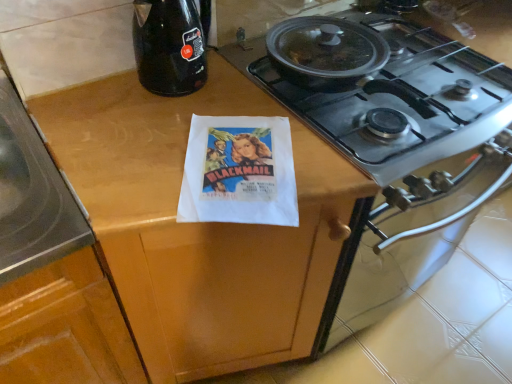
What do you see at coordinates (169, 46) in the screenshot?
I see `black glass bottle at upper left` at bounding box center [169, 46].

You are a GUI agent. You are given a task and a screenshot of the screen. Output one action in this format:
    pyautogui.click(x=<x>, y=<y>)
    Task: Click on the white paper flyer at center
    
    Given the screenshot: What is the action you would take?
    pyautogui.click(x=239, y=172)

Is black glass bottle at upper left bigger than wooden at center?

No, black glass bottle at upper left is not bigger than wooden at center.

From the image's perspective, is black glass bottle at upper left under wooden at center?

No.

In terms of height, does black glass bottle at upper left look taller or shorter compared to wooden at center?

Considering their sizes, black glass bottle at upper left has less height than wooden at center.

Based on the photo, is black glass bottle at upper left directly adjacent to wooden at center?

black glass bottle at upper left and wooden at center are clearly separated.

Which is farther from the camera, (x=240, y=353) or (x=160, y=89)?

The point (x=240, y=353) is farther from the camera.

Which object is positioned more to the right, wooden at center or black glass bottle at upper left?

wooden at center is more to the right.

In the scene shown: From the image's perspective, is wooden at center above black glass bottle at upper left?

No, from the image's perspective, wooden at center is not on top of black glass bottle at upper left.

Is stainless steel gas stove at upper right located outside black glass bottle at upper left?

Yes, stainless steel gas stove at upper right is located beyond the bounds of black glass bottle at upper left.

Can you tell me how much stainless steel gas stove at upper right and black glass bottle at upper left differ in facing direction?

2.15 degrees separate the facing orientations of stainless steel gas stove at upper right and black glass bottle at upper left.

Consider the image. Which object is closer to the camera, stainless steel gas stove at upper right or black glass bottle at upper left?

Positioned in front is stainless steel gas stove at upper right.

Is wooden at center not inside stainless steel gas stove at upper right?

Indeed, wooden at center is completely outside stainless steel gas stove at upper right.

Is wooden at center oriented towards stainless steel gas stove at upper right?

No, wooden at center does not turn towards stainless steel gas stove at upper right.

Looking at this image, which of these two, wooden at center or stainless steel gas stove at upper right, is smaller?

With smaller size is stainless steel gas stove at upper right.

Considering the relative positions of stainless steel gas stove at upper right and white paper flyer at center in the image provided, is stainless steel gas stove at upper right in front of white paper flyer at center?

Yes.

Does stainless steel gas stove at upper right have a greater width compared to white paper flyer at center?

Yes, stainless steel gas stove at upper right is wider than white paper flyer at center.

Looking at this image, is stainless steel gas stove at upper right oriented away from white paper flyer at center?

stainless steel gas stove at upper right does not have its back to white paper flyer at center.

Is stainless steel gas stove at upper right shorter than white paper flyer at center?

No, stainless steel gas stove at upper right is not shorter than white paper flyer at center.

From the image's perspective, who appears lower, wooden at center or white paper flyer at center?

From the image's view, wooden at center is below.

Measure the distance from wooden at center to white paper flyer at center.

They are 15.72 centimeters apart.

Which object is positioned more to the left, wooden at center or white paper flyer at center?

wooden at center is more to the left.

Based on the photo, would you say white paper flyer at center is part of wooden at center's contents?

Yes.

Between black glass bottle at upper left and stainless steel gas stove at upper right, which one is positioned behind?

black glass bottle at upper left is further away from the camera.

Can you confirm if black glass bottle at upper left is bigger than stainless steel gas stove at upper right?

Actually, black glass bottle at upper left might be smaller than stainless steel gas stove at upper right.

From a real-world perspective, relative to stainless steel gas stove at upper right, is black glass bottle at upper left vertically above or below?

black glass bottle at upper left is situated lower than stainless steel gas stove at upper right in the real world.

Image resolution: width=512 pixels, height=384 pixels. Identify the location of bottle behind the stainless steel gas stove at upper right. coord(169,46).

This screenshot has height=384, width=512. I want to click on counter lying in front of the black glass bottle at upper left, so click(x=198, y=226).

Find the location of a particular element. This screenshot has height=384, width=512. bottle located behind the wooden at center is located at coordinates (169, 46).

Considering their positions, is black glass bottle at upper left positioned further to wooden at center than stainless steel gas stove at upper right?

Among the two, stainless steel gas stove at upper right is located further to wooden at center.

Which object lies further to the anchor point black glass bottle at upper left, stainless steel gas stove at upper right or wooden at center?

stainless steel gas stove at upper right is further to black glass bottle at upper left.

Based on their spatial positions, is stainless steel gas stove at upper right or wooden at center closer to white paper flyer at center?

wooden at center is positioned closer to the anchor white paper flyer at center.

Which object lies further to the anchor point stainless steel gas stove at upper right, wooden at center or white paper flyer at center?

wooden at center is further to stainless steel gas stove at upper right.

Which object lies nearer to the anchor point white paper flyer at center, wooden at center or stainless steel gas stove at upper right?

wooden at center lies closer to white paper flyer at center than the other object.

Estimate the real-world distances between objects in this image. Which object is further from white paper flyer at center, black glass bottle at upper left or stainless steel gas stove at upper right?

stainless steel gas stove at upper right lies further to white paper flyer at center than the other object.

When comparing their distances from stainless steel gas stove at upper right, does black glass bottle at upper left or white paper flyer at center seem further?

black glass bottle at upper left is positioned further to the anchor stainless steel gas stove at upper right.

Looking at the image, which one is located further to stainless steel gas stove at upper right, black glass bottle at upper left or wooden at center?

black glass bottle at upper left is further to stainless steel gas stove at upper right.

Where is `flyer located between black glass bottle at upper left and stainless steel gas stove at upper right in the left-right direction`? This screenshot has height=384, width=512. flyer located between black glass bottle at upper left and stainless steel gas stove at upper right in the left-right direction is located at coordinates (239, 172).

Locate an element on the screen. This screenshot has width=512, height=384. bottle that lies between stainless steel gas stove at upper right and wooden at center from top to bottom is located at coordinates (169, 46).

You are a GUI agent. You are given a task and a screenshot of the screen. Output one action in this format:
    pyautogui.click(x=<x>, y=<y>)
    Task: Click on the flyer that lies between black glass bottle at upper left and wooden at center from top to bottom
    This screenshot has width=512, height=384.
    Given the screenshot: What is the action you would take?
    pyautogui.click(x=239, y=172)

You are a GUI agent. You are given a task and a screenshot of the screen. Output one action in this format:
    pyautogui.click(x=<x>, y=<y>)
    Task: Click on the flyer between stainless steel gas stove at upper right and wooden at center in the up-down direction
    
    Given the screenshot: What is the action you would take?
    pyautogui.click(x=239, y=172)